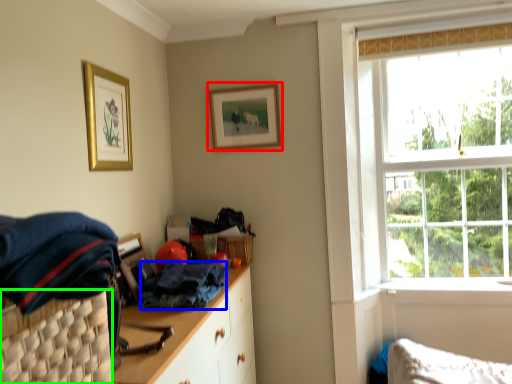
Question: Which object is the closest to the picture frame (highlighted by a red box)? Choose among these: clothing (highlighted by a blue box) or basket (highlighted by a green box).

Choices:
 (A) clothing
 (B) basket

Answer: (A)